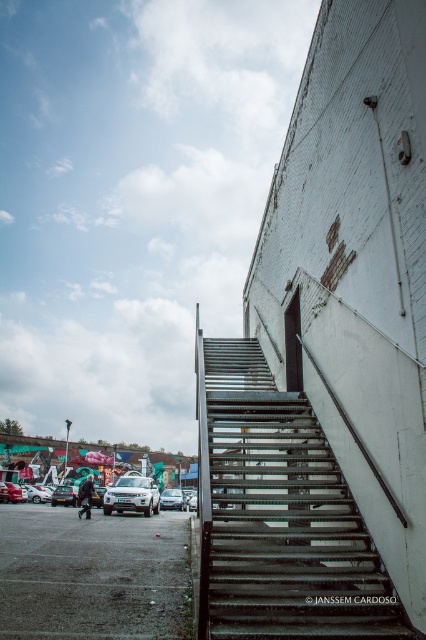
You are a delivery driver who needs to park your vehicle in the parking lot shown in the image. You have a white matte suv at lower center and a satin silver sedan at center. Which vehicle is positioned higher up in the parking lot?

The white matte suv at lower center is above the satin silver sedan at center, so the white matte suv at lower center is positioned higher up in the parking lot.

You are standing in the urban scene and want to take a photo of the metallic gray stairs at center and the dark asphalt parking lot at lower left. Which object will appear larger in the photo?

The metallic gray stairs at center will appear larger in the photo because they are closer to the viewer than the dark asphalt parking lot at lower left.

You are standing at the bottom of the metal stairs leading up to the white brick wall. You see two points marked on the ground near the stairs. One is at point (52,614) and the other at point (175,499). Which point is closer to you as you face the stairs?

Point (52,614) is in front of point (175,499), so it is closer to you as you face the stairs.